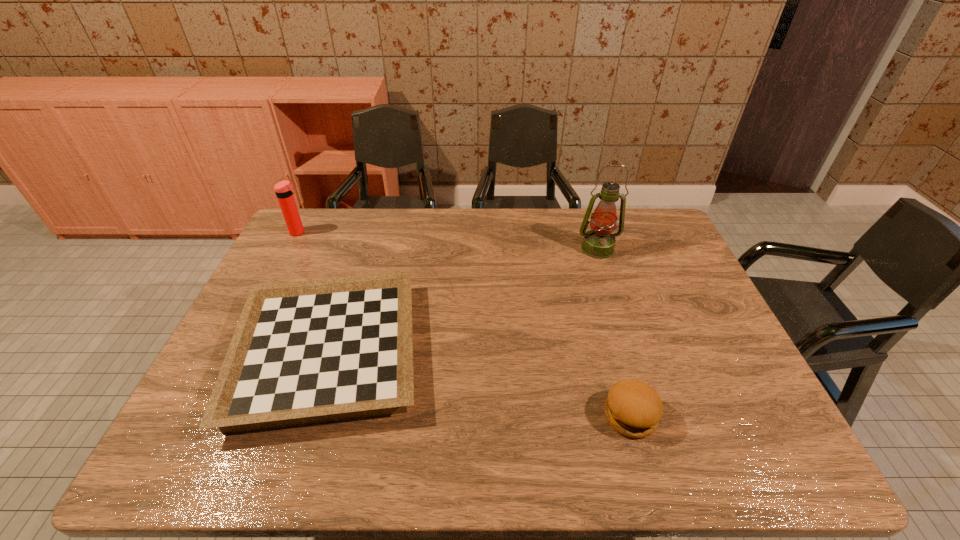
Where is `vacant space in between the third nearest object and the checkerboard`? Image resolution: width=960 pixels, height=540 pixels. vacant space in between the third nearest object and the checkerboard is located at coordinates (463, 301).

Find the location of `free space between the third nearest object and the second shortest object`. free space between the third nearest object and the second shortest object is located at coordinates (613, 332).

Locate an element on the screen. The image size is (960, 540). blank region between the shortest object and the hamburger is located at coordinates (479, 384).

In order to click on the closest object relative to the checkerboard in this screenshot , I will do `click(284, 190)`.

What are the coordinates of `the third closest object to the farthest object` in the screenshot? It's located at (632, 408).

At what (x,y) coordinates should I click in order to perform the action: click on free space in the image that satisfies the following two spatial constraints: 1. on the back side of the oil lamp; 2. on the left side of the third tallest object. Please return your answer as a coordinate pair (x, y). Image resolution: width=960 pixels, height=540 pixels. Looking at the image, I should click on click(584, 248).

What are the coordinates of `vacant point that satisfies the following two spatial constraints: 1. on the front side of the hamburger; 2. on the right side of the third shortest object` in the screenshot? It's located at (204, 416).